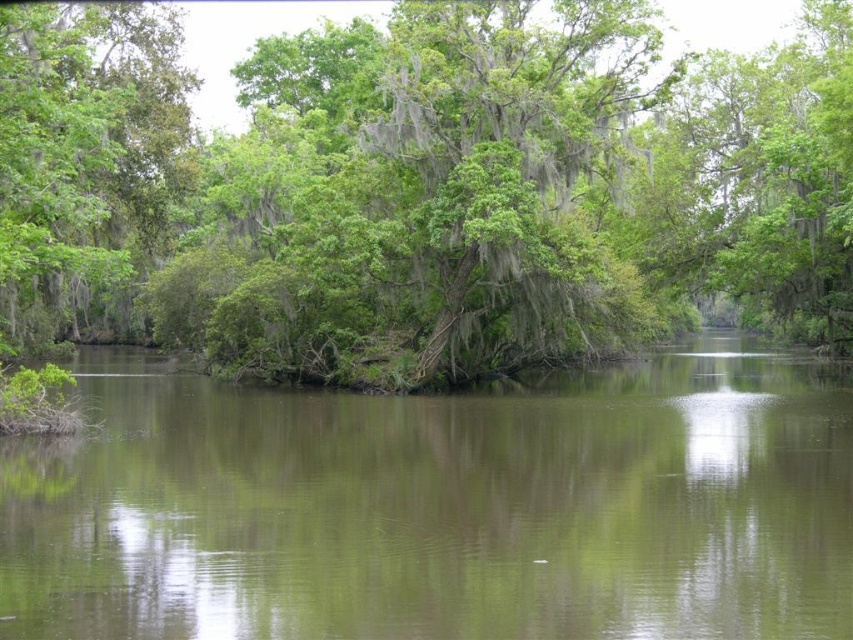
You are standing in the swamp scene and want to walk towards the green leafy tree at center and the green reflective water at center. Which object will you reach first?

You will reach the green leafy tree at center first because it is closer to you than the green reflective water at center, which is further away.

From the picture: You are standing in the swamp scene and want to walk from the green leafy tree at center to the green reflective water at center. Which direction should you move to reach the water?

You should move to the right to reach the green reflective water at center because the green leafy tree at center is positioned on the left side of it.

You are a photographer standing in the swamp scene. You want to take a photo that includes both the point at coordinates point (x=213, y=200) and point (x=616, y=634). Based on their positions, which point will appear closer to the front of the photo?

Point (x=213, y=200) is further to the camera than point (x=616, y=634), so it will appear closer to the front of the photo.